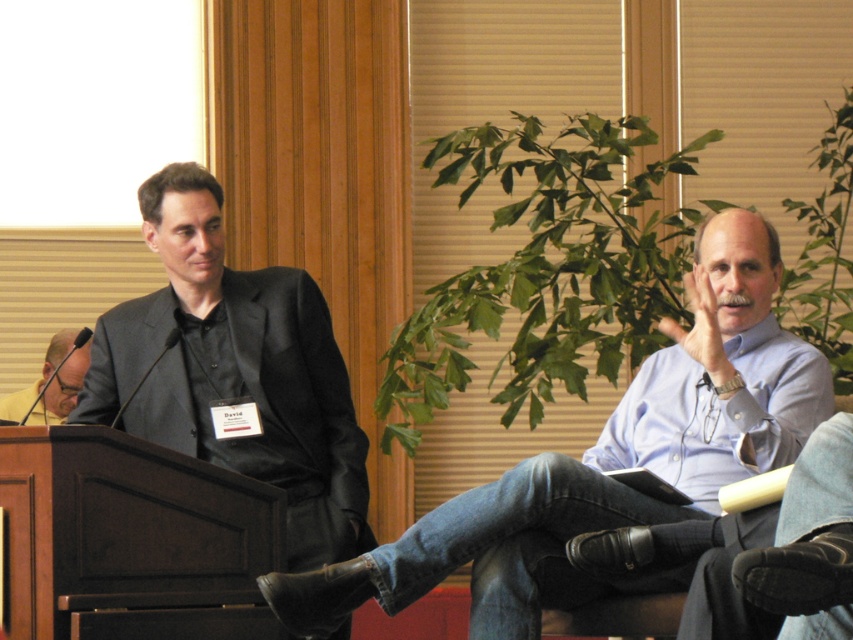
You are attending a conference in the room and need to move from the podium to the exit located at the back of the room. The blue shirt at right is blocking your path. Can you go around them to reach the exit?

The blue shirt at right is located at point (608, 458), which is near the right side of the scene. Since the exit is at the back, you can go around them by moving to the left side of the room to reach the exit.

You are an event organizer and need to arrange seating for two attendees based on their height. The blue shirt at right and the dark gray suit at left are present. Which attendee should you seat in the front row to ensure visibility?

The blue shirt at right is shorter than the dark gray suit at left, so seating the blue shirt at right in the front row would ensure better visibility for both attendees.